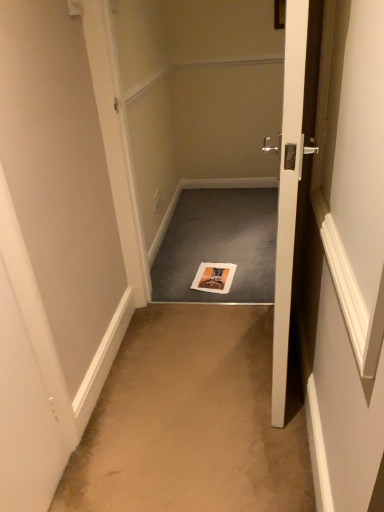
Question: Considering the relative sizes of gray carpet at center and white glossy door at center in the image provided, is gray carpet at center smaller than white glossy door at center?

Choices:
 (A) yes
 (B) no

Answer: (A)

Question: Is gray carpet at center positioned far away from white glossy door at center?

Choices:
 (A) yes
 (B) no

Answer: (A)

Question: Does gray carpet at center have a lesser width compared to white glossy door at center?

Choices:
 (A) yes
 (B) no

Answer: (B)

Question: Is the depth of gray carpet at center greater than that of white glossy door at center?

Choices:
 (A) yes
 (B) no

Answer: (A)

Question: From the image's perspective, would you say gray carpet at center is positioned over white glossy door at center?

Choices:
 (A) no
 (B) yes

Answer: (B)

Question: In terms of height, does orange matte magazine at center look taller or shorter compared to white glossy door at center?

Choices:
 (A) short
 (B) tall

Answer: (A)

Question: From a real-world perspective, relative to white glossy door at center, is orange matte magazine at center vertically above or below?

Choices:
 (A) below
 (B) above

Answer: (A)

Question: Visually, is orange matte magazine at center positioned to the left or to the right of white glossy door at center?

Choices:
 (A) left
 (B) right

Answer: (A)

Question: Looking at their shapes, would you say orange matte magazine at center is wider or thinner than white glossy door at center?

Choices:
 (A) thin
 (B) wide

Answer: (B)

Question: Would you say gray carpet at center is inside or outside beige carpet at center?

Choices:
 (A) outside
 (B) inside

Answer: (A)

Question: Considering the positions of point (180, 193) and point (254, 509), is point (180, 193) closer or farther from the camera than point (254, 509)?

Choices:
 (A) farther
 (B) closer

Answer: (A)

Question: Considering the positions of gray carpet at center and beige carpet at center in the image, is gray carpet at center taller or shorter than beige carpet at center?

Choices:
 (A) tall
 (B) short

Answer: (B)

Question: From a real-world perspective, is gray carpet at center positioned above or below beige carpet at center?

Choices:
 (A) below
 (B) above

Answer: (B)

Question: In the image, is orange matte magazine at center on the left side or the right side of beige carpet at center?

Choices:
 (A) left
 (B) right

Answer: (B)

Question: Is orange matte magazine at center bigger or smaller than beige carpet at center?

Choices:
 (A) big
 (B) small

Answer: (B)